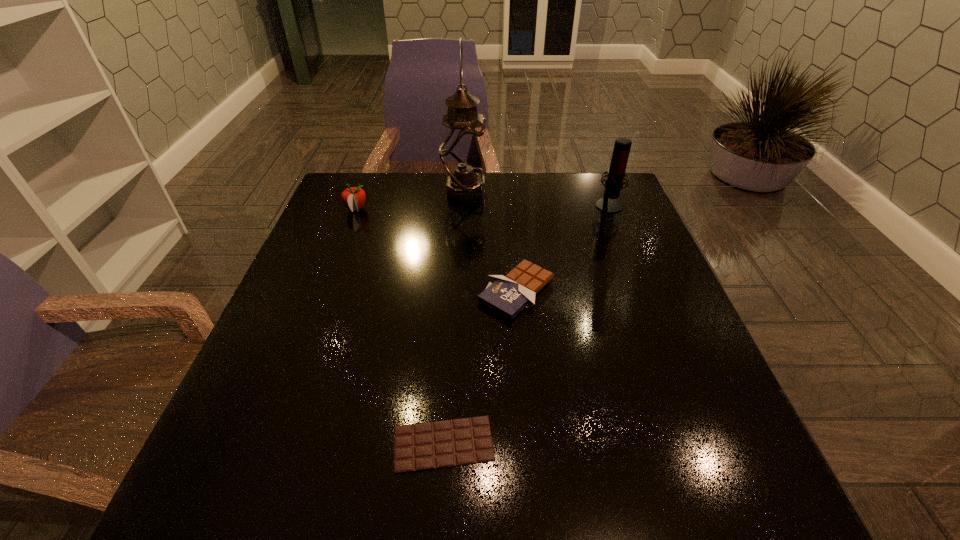
At what (x,y) coordinates should I click in order to perform the action: click on object at the far left corner. Please return your answer as a coordinate pair (x, y). Looking at the image, I should click on coord(353,198).

Identify the location of object that is at the far right corner. The height and width of the screenshot is (540, 960). (616, 173).

The height and width of the screenshot is (540, 960). In order to click on free space at the far edge of the desktop in this screenshot , I will do `click(419, 180)`.

The width and height of the screenshot is (960, 540). In the image, there is a desktop. Identify the location of free space at the near edge. (566, 489).

Identify the location of vacant area at the left edge. The image size is (960, 540). (334, 250).

What are the coordinates of `free space at the right edge of the desktop` in the screenshot? It's located at (595, 223).

This screenshot has height=540, width=960. I want to click on vacant region at the far left corner of the desktop, so click(332, 211).

In the image, there is a desktop. Where is `vacant area at the near left corner`? The height and width of the screenshot is (540, 960). vacant area at the near left corner is located at coordinates (241, 520).

Find the location of a particular element. The width and height of the screenshot is (960, 540). vacant area at the near right corner of the desktop is located at coordinates [x=684, y=501].

Find the location of a particular element. free space between the apple and the shortest object is located at coordinates (400, 327).